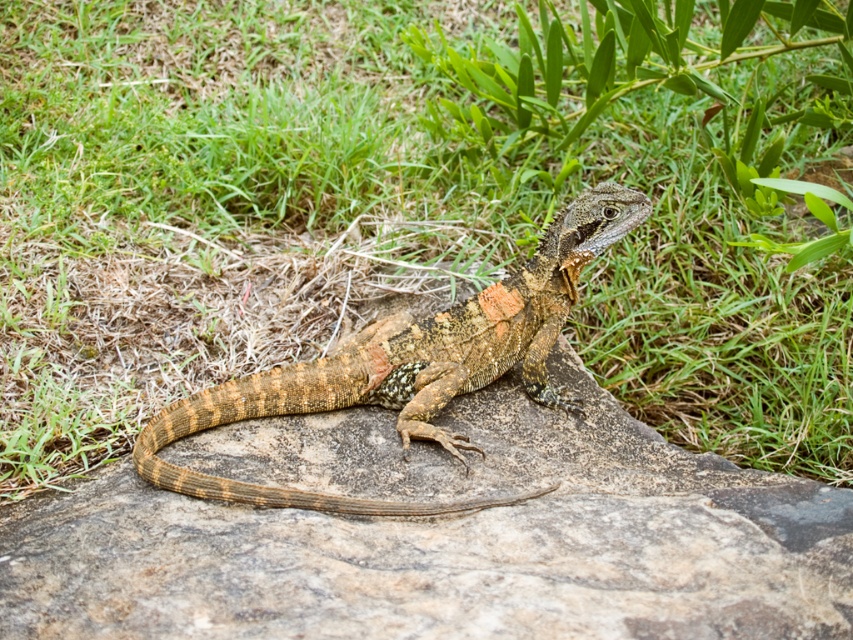
Who is more distant from viewer, (195, 545) or (465, 321)?

Point (465, 321)

Can you confirm if brown rough stone at center is taller than speckled brown lizard at center?

No, brown rough stone at center is not taller than speckled brown lizard at center.

Is point (554, 632) positioned after point (509, 364)?

No, (554, 632) is in front of (509, 364).

You are a GUI agent. You are given a task and a screenshot of the screen. Output one action in this format:
    pyautogui.click(x=<x>, y=<y>)
    Task: Click on the brown rough stone at center
    This screenshot has width=853, height=640.
    Given the screenshot: What is the action you would take?
    pyautogui.click(x=438, y=536)